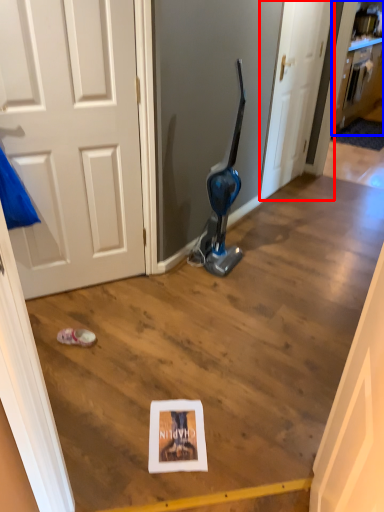
Question: Which object appears closest to the camera in this image, door (highlighted by a red box) or cabinetry (highlighted by a blue box)?

Choices:
 (A) door
 (B) cabinetry

Answer: (A)